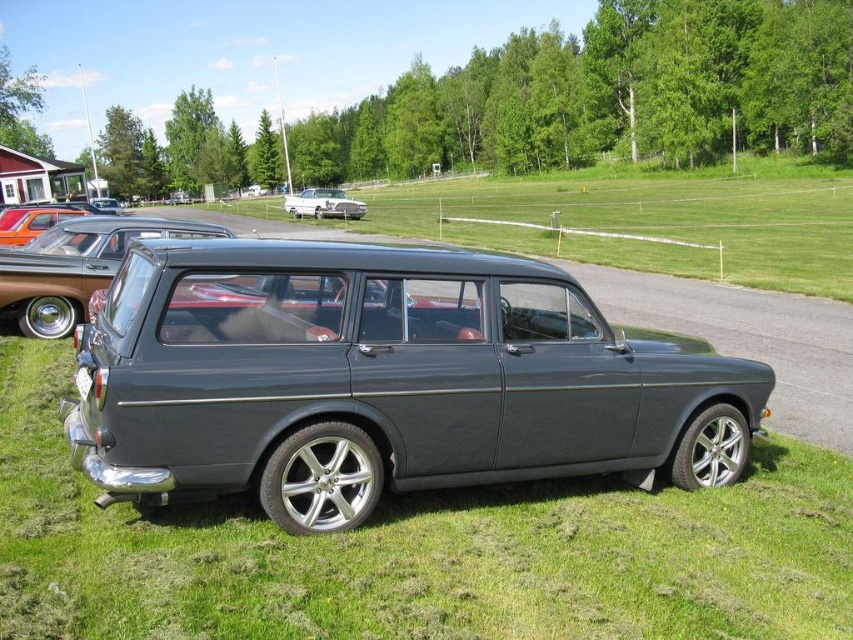
Measure the distance from orange metallic car at left to white plastic license plate at lower center.

A distance of 16.90 meters exists between orange metallic car at left and white plastic license plate at lower center.

Consider the image. Which is above, orange metallic car at left or white plastic license plate at lower center?

orange metallic car at left is higher up.

Is point (15, 244) closer to camera compared to point (90, 376)?

No.

This screenshot has height=640, width=853. I want to click on orange metallic car at left, so click(x=32, y=221).

Who is positioned more to the left, shiny silver sedan at center or white plastic license plate at lower center?

shiny silver sedan at center

Is shiny silver sedan at center smaller than white plastic license plate at lower center?

No, shiny silver sedan at center is not smaller than white plastic license plate at lower center.

Is point (310, 214) in front of point (80, 372)?

No, it is behind (80, 372).

I want to click on shiny silver sedan at center, so click(323, 204).

Does satin dark gray station wagon at center appear under orange metallic car at left?

Yes.

This screenshot has width=853, height=640. What are the coordinates of `satin dark gray station wagon at center` in the screenshot? It's located at (383, 380).